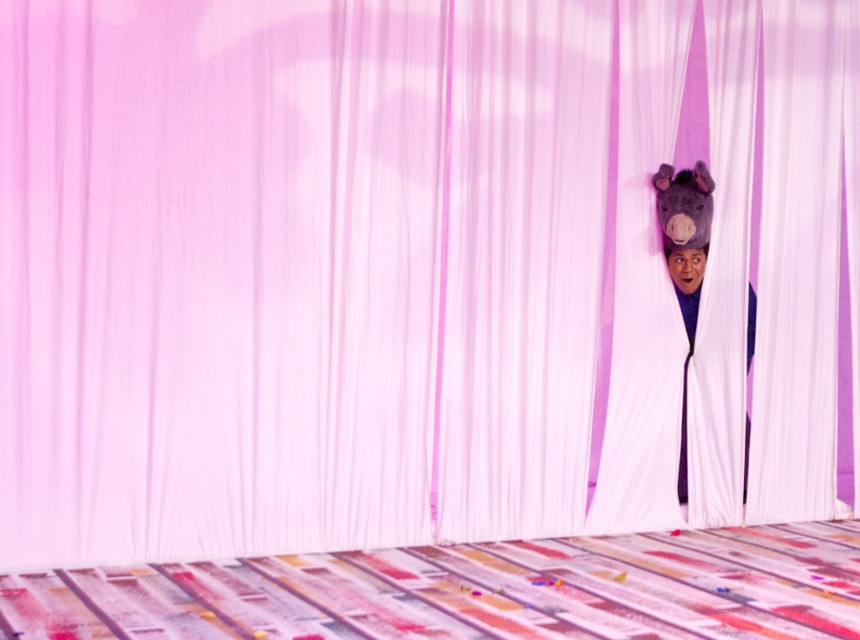
You are standing in the center of the stage and want to move to the multicolored fabric bed at center. Which direction should you move to reach it?

The multicolored fabric bed at center is already at the center of the stage, so you don not need to move in any direction to reach it.